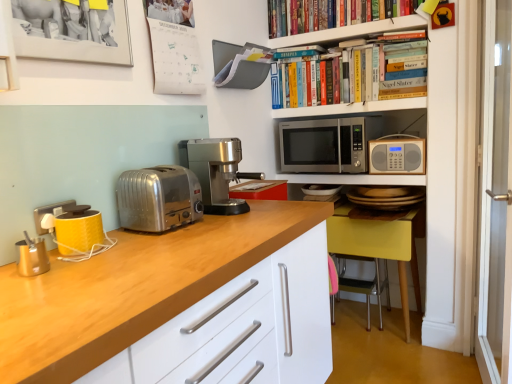
This screenshot has height=384, width=512. Find the location of `vacant area in front of yellow wood chair at lower right, the 1th chair positioned from the front`. vacant area in front of yellow wood chair at lower right, the 1th chair positioned from the front is located at coordinates (386, 353).